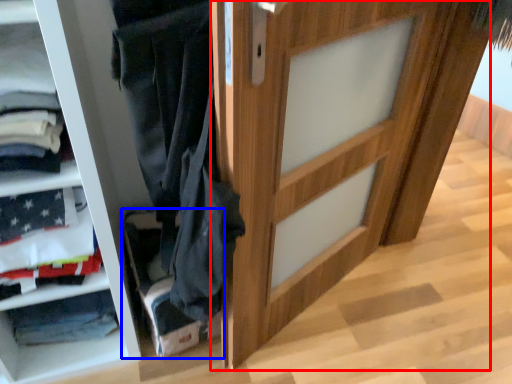
Question: Which point is further to the camera, door (highlighted by a red box) or shelf (highlighted by a blue box)?

Choices:
 (A) door
 (B) shelf

Answer: (B)